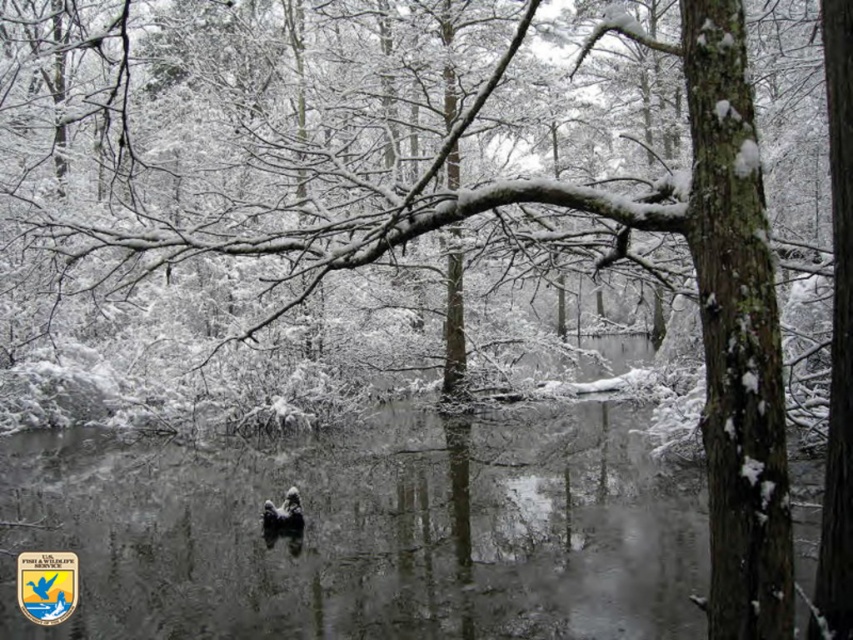
From the picture: You are a photographer trying to capture the reflection of the ducks in the water. Since the clear water at center and dark gray fur at center are both in your viewfinder, which one will show a better reflection?

The clear water at center is taller than dark gray fur at center, so the clear water at center will provide a better reflection for the ducks because it has a larger surface area.

Based on the photo, you are a wildlife photographer aiming to capture a closeup of the dark gray fur at center while also including the clear water at center in the frame. Given that your camera lens has a maximum focus range of 8 feet, can you achieve this shot without moving closer?

The clear water at center and dark gray fur at center are 7.85 feet apart. Since the distance between them is within the camera lens maximum focus range of 8 feet, you can achieve the shot without moving closer.

You are a hiker who wants to cross the clear water at center to reach the dark gray fur at center. Is the water shallow enough for you to walk across?

The clear water at center is above dark gray fur at center, so the water is shallow enough for you to walk across.